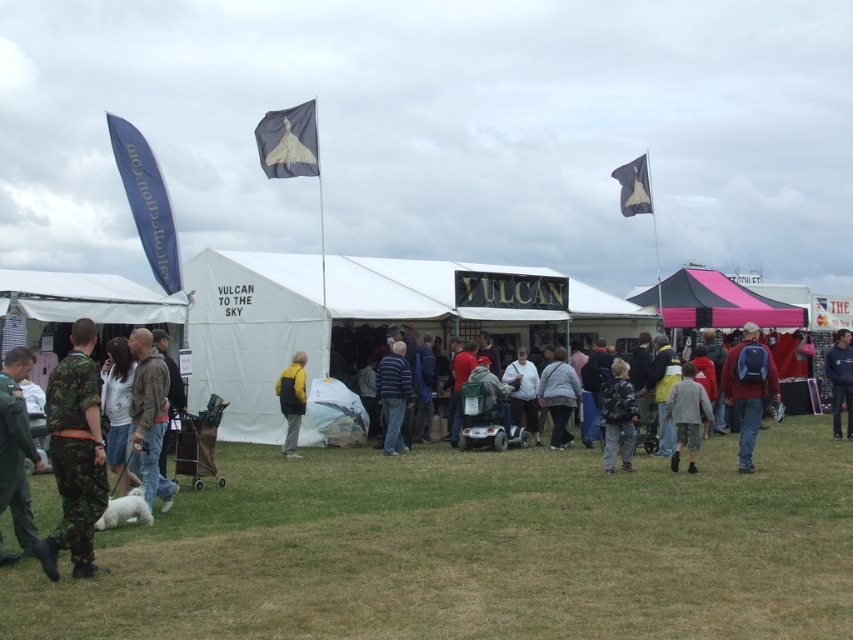
Between camouflage jacket at center and yellow matte jacket at center, which one has less height?

camouflage jacket at center is shorter.

What do you see at coordinates (618, 417) in the screenshot?
I see `camouflage jacket at center` at bounding box center [618, 417].

Which is in front, point (619, 449) or point (294, 433)?

Point (619, 449) is in front.

Image resolution: width=853 pixels, height=640 pixels. I want to click on camouflage jacket at center, so click(618, 417).

Which is below, camouflage uniform at left or camouflage jacket at center?

camouflage jacket at center is below.

Between point (10, 458) and point (613, 378), which one is positioned behind?

Positioned behind is point (613, 378).

What do you see at coordinates (16, 448) in the screenshot? I see `camouflage uniform at left` at bounding box center [16, 448].

At what (x,y) coordinates should I click in order to perform the action: click on camouflage uniform at left. Please return your answer as a coordinate pair (x, y). Image resolution: width=853 pixels, height=640 pixels. Looking at the image, I should click on (16, 448).

Consider the image. Is camouflage fabric uniform at lower left to the right of camouflage pants at lower right from the viewer's perspective?

In fact, camouflage fabric uniform at lower left is to the left of camouflage pants at lower right.

Does camouflage fabric uniform at lower left have a larger size compared to camouflage pants at lower right?

Yes, camouflage fabric uniform at lower left is bigger than camouflage pants at lower right.

Does point (62, 419) come closer to viewer compared to point (851, 410)?

That is True.

The width and height of the screenshot is (853, 640). Find the location of `camouflage fabric uniform at lower left`. camouflage fabric uniform at lower left is located at coordinates (74, 454).